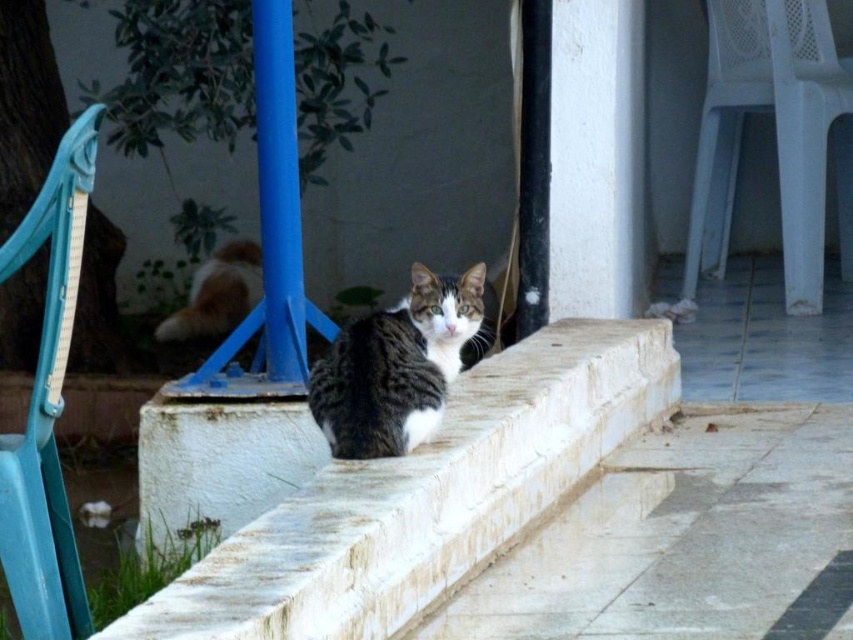
Question: Estimate the real-world distances between objects in this image. Which object is farther from the white stone steps at center?

Choices:
 (A) gray tabby cat at center
 (B) orange tabby cat at center
 (C) white plastic chair at right

Answer: (B)

Question: Which of the following is the closest to the observer?

Choices:
 (A) white stone steps at center
 (B) white stone ledge at center

Answer: (B)

Question: Does white stone ledge at center appear under white stone steps at center?

Choices:
 (A) no
 (B) yes

Answer: (A)

Question: Considering the relative positions of white stone ledge at center and gray tabby cat at center in the image provided, where is white stone ledge at center located with respect to gray tabby cat at center?

Choices:
 (A) below
 (B) above

Answer: (A)

Question: Which point is farther to the camera?

Choices:
 (A) (498, 566)
 (B) (811, 218)

Answer: (B)

Question: Is white stone ledge at center further to camera compared to teal plastic chair at left?

Choices:
 (A) yes
 (B) no

Answer: (B)